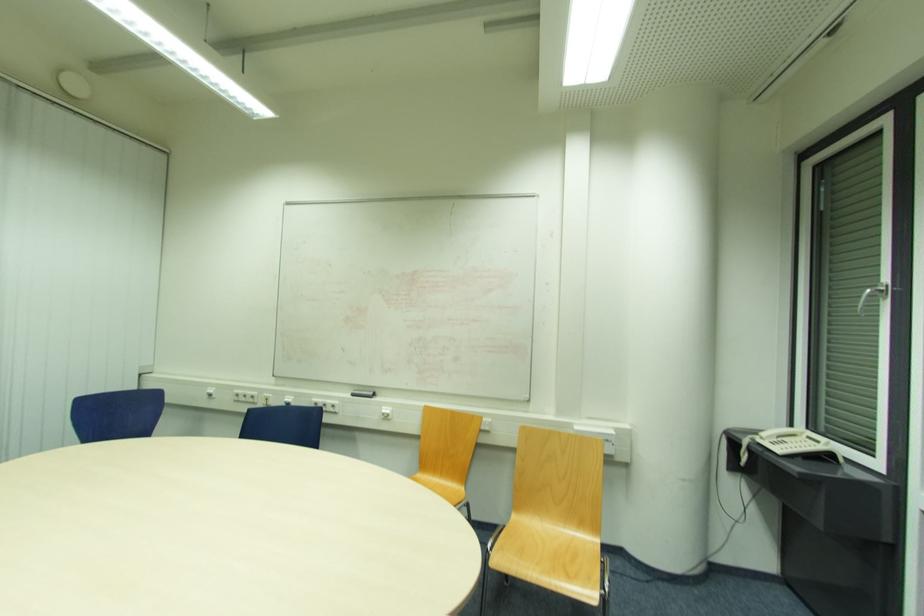
Where would you lift the white telephone handset? Please return your answer as a coordinate pair (x, y).

(779, 432)